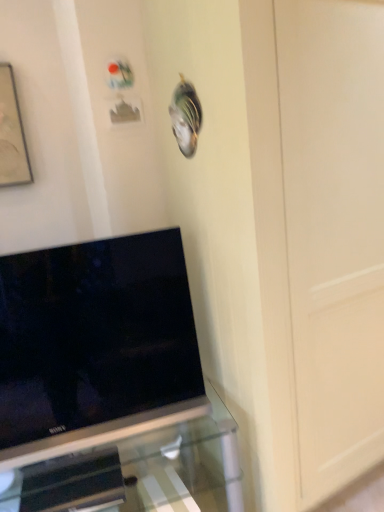
Question: Considering the relative sizes of black glossy tv at lower left and matte black picture frame at upper left in the image provided, is black glossy tv at lower left shorter than matte black picture frame at upper left?

Choices:
 (A) no
 (B) yes

Answer: (A)

Question: Is black glossy tv at lower left positioned before matte black picture frame at upper left?

Choices:
 (A) no
 (B) yes

Answer: (B)

Question: Could matte black picture frame at upper left be considered to be inside black glossy tv at lower left?

Choices:
 (A) no
 (B) yes

Answer: (A)

Question: Can we say black glossy tv at lower left lies outside matte black picture frame at upper left?

Choices:
 (A) yes
 (B) no

Answer: (A)

Question: Considering the relative sizes of black glossy tv at lower left and matte black picture frame at upper left in the image provided, is black glossy tv at lower left taller than matte black picture frame at upper left?

Choices:
 (A) yes
 (B) no

Answer: (A)

Question: Relative to transparent glass tv stand at lower left, is black glossy tv at lower left in front or behind?

Choices:
 (A) behind
 (B) front

Answer: (A)

Question: Considering the positions of point (198, 398) and point (117, 443), is point (198, 398) closer or farther from the camera than point (117, 443)?

Choices:
 (A) farther
 (B) closer

Answer: (B)

Question: Is black glossy tv at lower left wider or thinner than transparent glass tv stand at lower left?

Choices:
 (A) wide
 (B) thin

Answer: (B)

Question: In terms of size, does black glossy tv at lower left appear bigger or smaller than transparent glass tv stand at lower left?

Choices:
 (A) big
 (B) small

Answer: (B)

Question: Is point (9, 450) positioned closer to the camera than point (1, 141)?

Choices:
 (A) closer
 (B) farther

Answer: (A)

Question: Visually, is black glossy tv at lower left positioned to the left or to the right of matte black picture frame at upper left?

Choices:
 (A) left
 (B) right

Answer: (B)

Question: Looking at their shapes, would you say black glossy tv at lower left is wider or thinner than matte black picture frame at upper left?

Choices:
 (A) wide
 (B) thin

Answer: (A)

Question: Considering the positions of black glossy tv at lower left and matte black picture frame at upper left in the image, is black glossy tv at lower left taller or shorter than matte black picture frame at upper left?

Choices:
 (A) short
 (B) tall

Answer: (B)

Question: Considering the positions of transparent glass tv stand at lower left and black glossy tv at lower left in the image, is transparent glass tv stand at lower left taller or shorter than black glossy tv at lower left?

Choices:
 (A) tall
 (B) short

Answer: (B)

Question: From a real-world perspective, is transparent glass tv stand at lower left positioned above or below black glossy tv at lower left?

Choices:
 (A) below
 (B) above

Answer: (A)